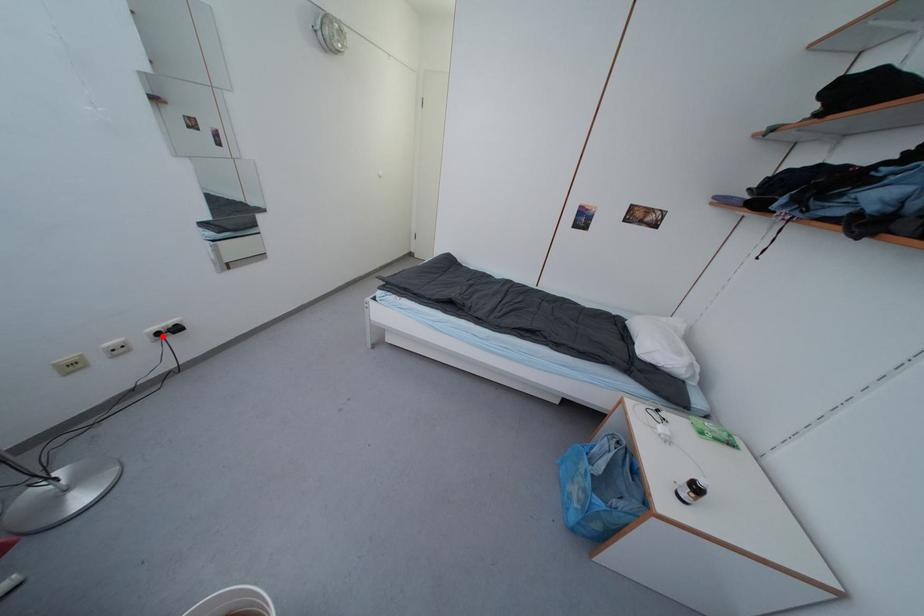
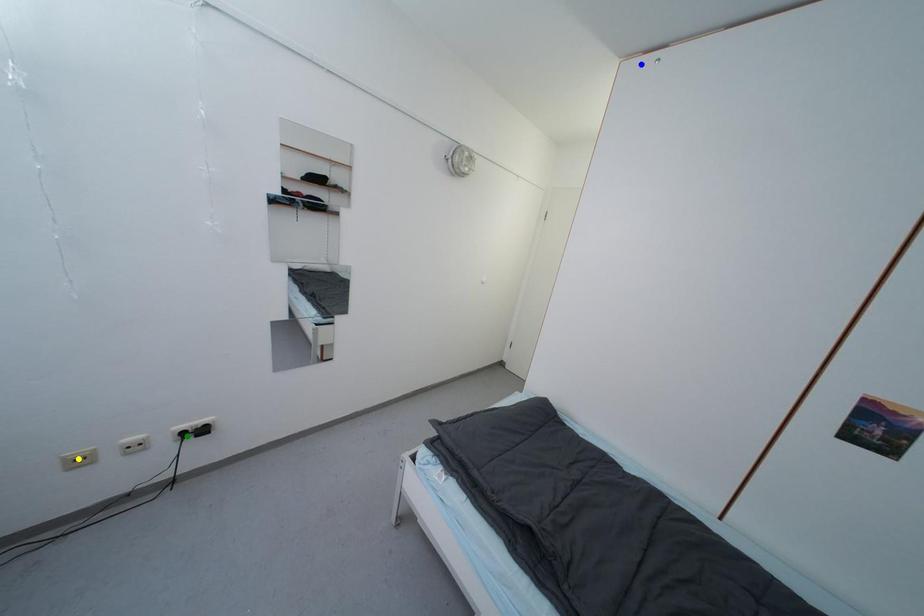
Question: I am providing you with two images of the same scene from different viewpoints. A red point is marked on the first image. You are given multiple points on the second image. Can you choose the point in image 2 that corresponds to the point in image 1?

Choices:
 (A) green point
 (B) blue point
 (C) yellow point

Answer: (A)